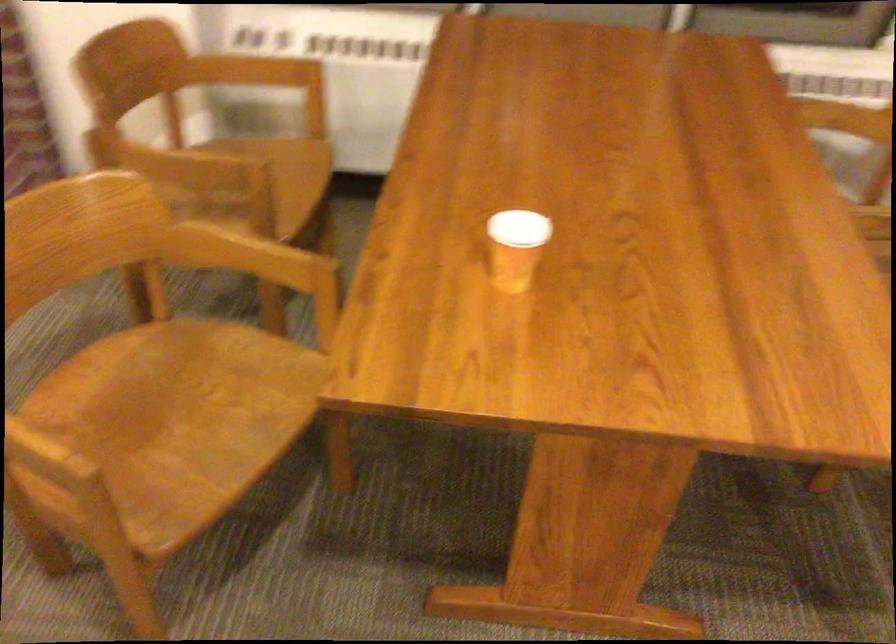
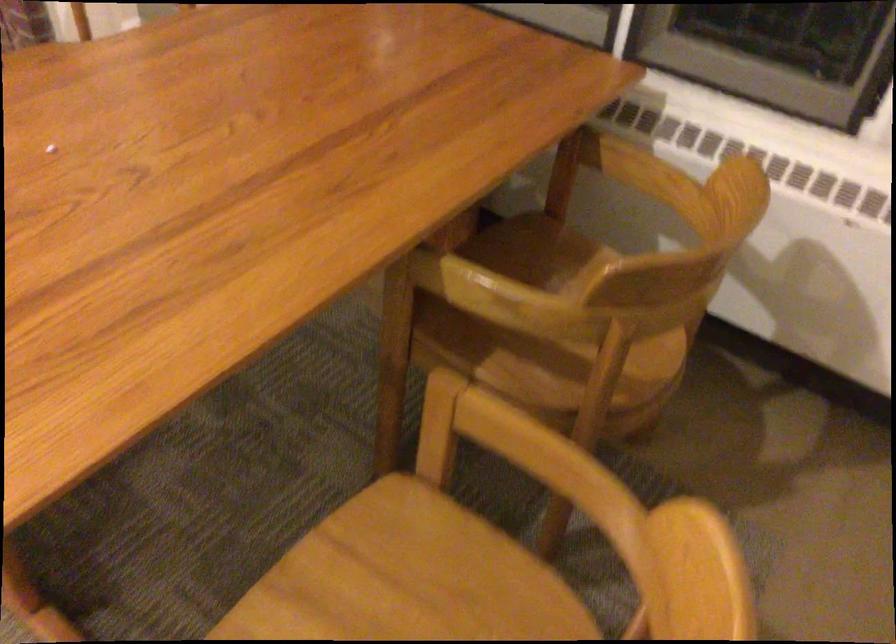
In a continuous first-person perspective shot, in which direction is the camera moving?

The cameraman walked toward right, forward.